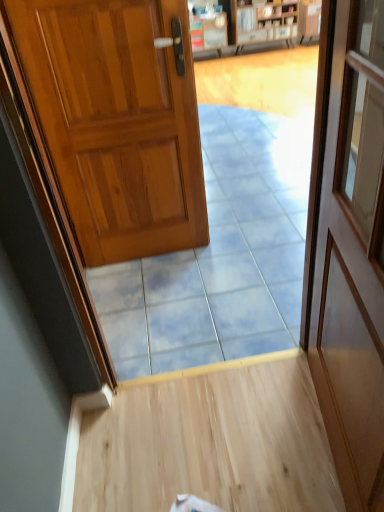
At what (x,y) coordinates should I click in order to perform the action: click on free space above blue glossy tile at center (from a real-world perspective). Please return your answer as a coordinate pair (x, y). Looking at the image, I should click on (191, 322).